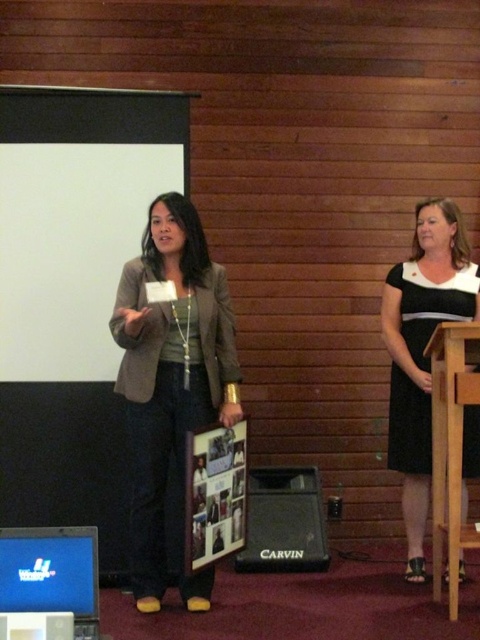
Does matte brown blazer at center come behind black plastic speaker at lower center?

No, matte brown blazer at center is closer to the viewer.

Is matte brown blazer at center shorter than black plastic speaker at lower center?

No, matte brown blazer at center is not shorter than black plastic speaker at lower center.

Between point (131, 365) and point (285, 561), which one is positioned behind?

The point (285, 561) is behind.

I want to click on matte brown blazer at center, so click(170, 388).

Who is more forward, (450, 353) or (255, 564)?

Point (450, 353)

Between point (450, 548) and point (257, 541), which one is positioned behind?

Point (257, 541)

Where is `wooden podium at right`? This screenshot has height=640, width=480. wooden podium at right is located at coordinates click(451, 445).

Who is shorter, white matte projection screen at upper left or wooden podium at right?

Standing shorter between the two is wooden podium at right.

Between point (29, 200) and point (445, 525), which one is positioned in front?

Point (445, 525) is more forward.

Image resolution: width=480 pixels, height=640 pixels. What are the coordinates of `white matte projection screen at upper left` in the screenshot? It's located at (75, 216).